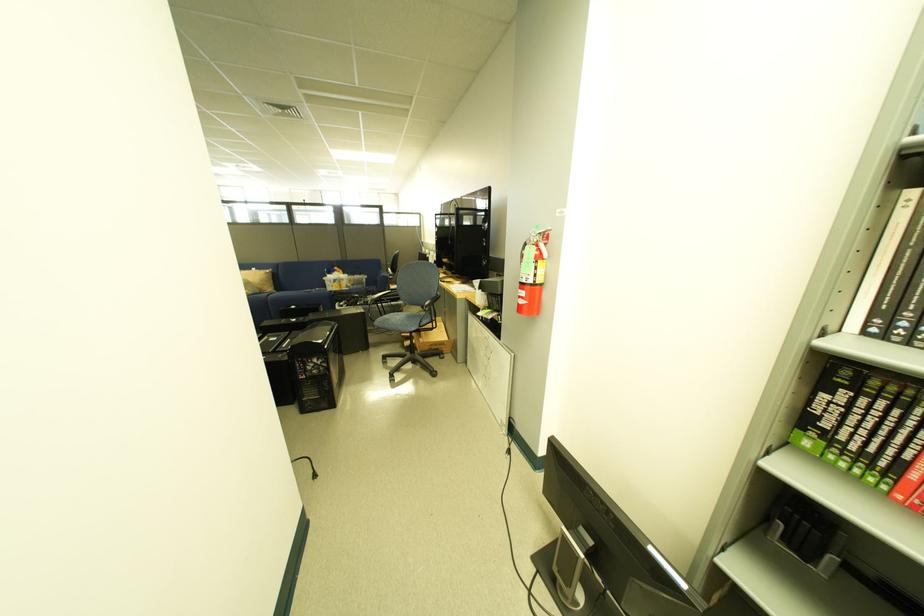
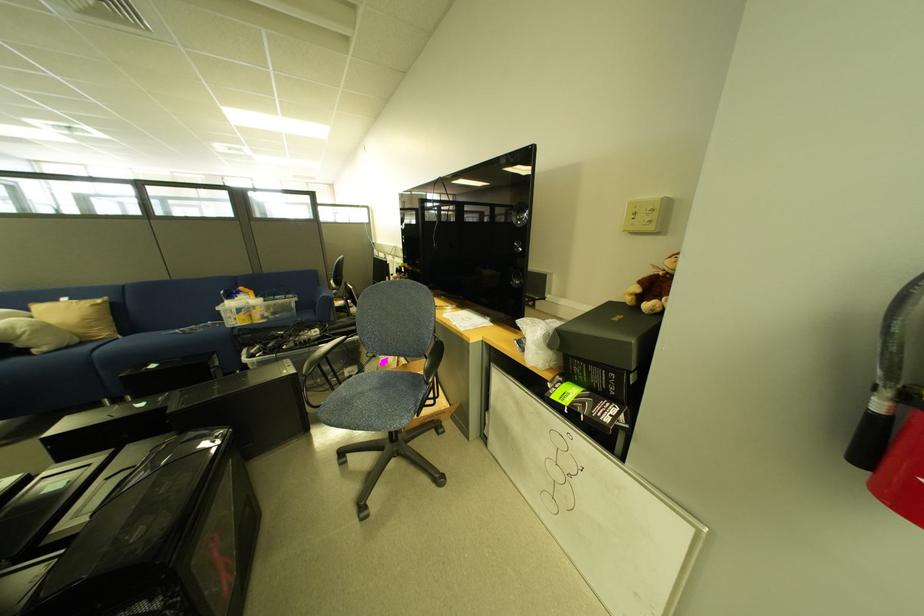
The images are taken continuously from a first-person perspective. In which direction are you moving?

The cameraman walked toward left, forward.